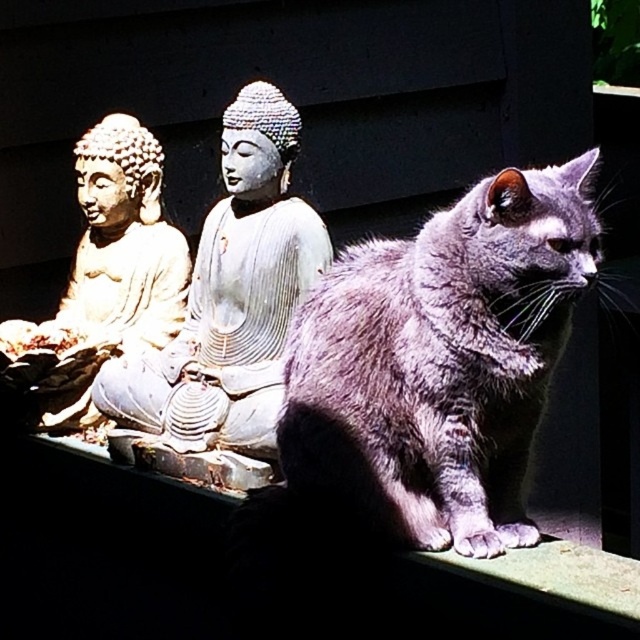
You are standing in front of two Buddha statues. The gray stone Buddha at center is marked by a point at coordinates (230,298). Can you determine which statue this point corresponds to?

The point at coordinates (230,298) corresponds to the gray stone Buddha at center.

You are a photographer trying to capture a photo of the satin gray cat at center and the gray stone buddha at center. Which one is shorter in height?

The satin gray cat at center is not as tall as the gray stone buddha at center, so the satin gray cat at center is shorter in height.

You are a photographer setting up a shot of the two Buddha statues and the cat. You want to ensure the satin gray cat at center is not too small in the frame compared to the matte gold statue at left. Based on their sizes, will the cat appear larger than the statue in the photo?

The satin gray cat at center has a larger size compared to the matte gold statue at left, so yes, the cat will appear larger than the statue in the photo.